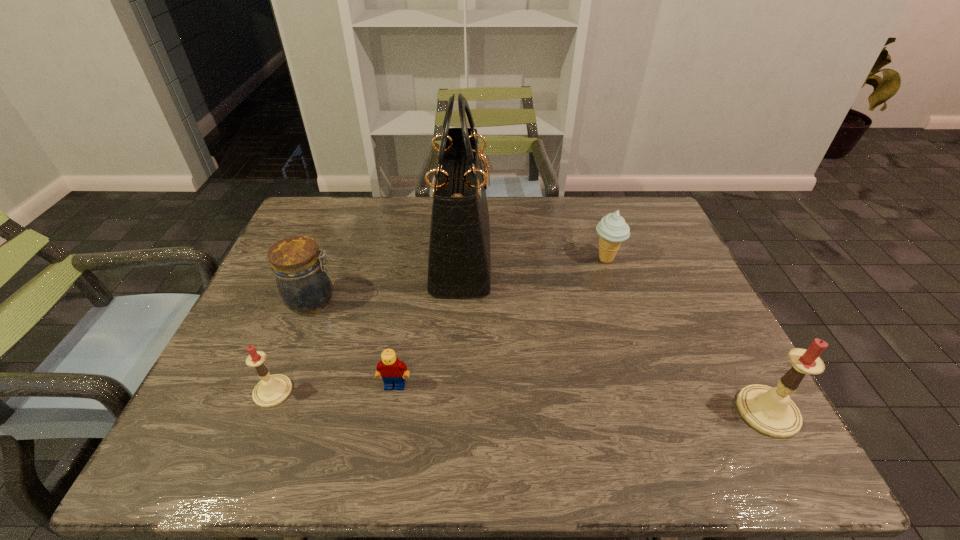
Identify the location of vacant region that satisfies the following two spatial constraints: 1. at the front of the icecream with visible charms; 2. on the right side of the tallest object. (461, 259).

Locate an element on the screen. free space that satisfies the following two spatial constraints: 1. on the back side of the shorter candle; 2. on the left side of the fifth object from left to right is located at coordinates (326, 259).

Identify the location of blank area in the image that satisfies the following two spatial constraints: 1. on the front side of the taller candle; 2. on the left side of the icecream. The height and width of the screenshot is (540, 960). (657, 411).